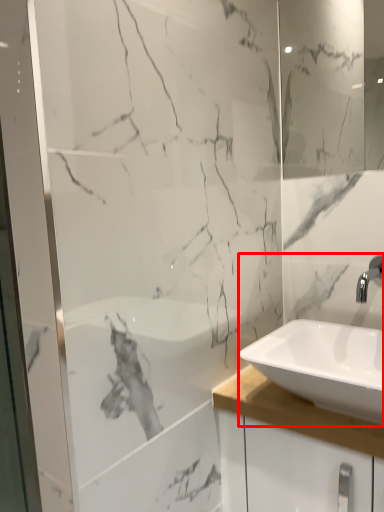
Question: From the image, what is the correct spatial relationship of sink (annotated by the red box) in relation to mirror?

Choices:
 (A) right
 (B) left

Answer: (B)